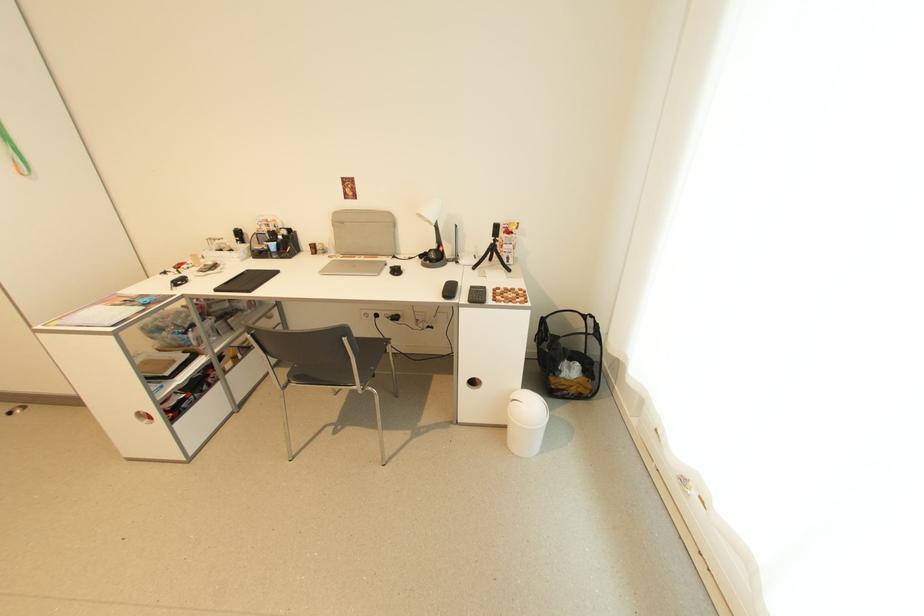
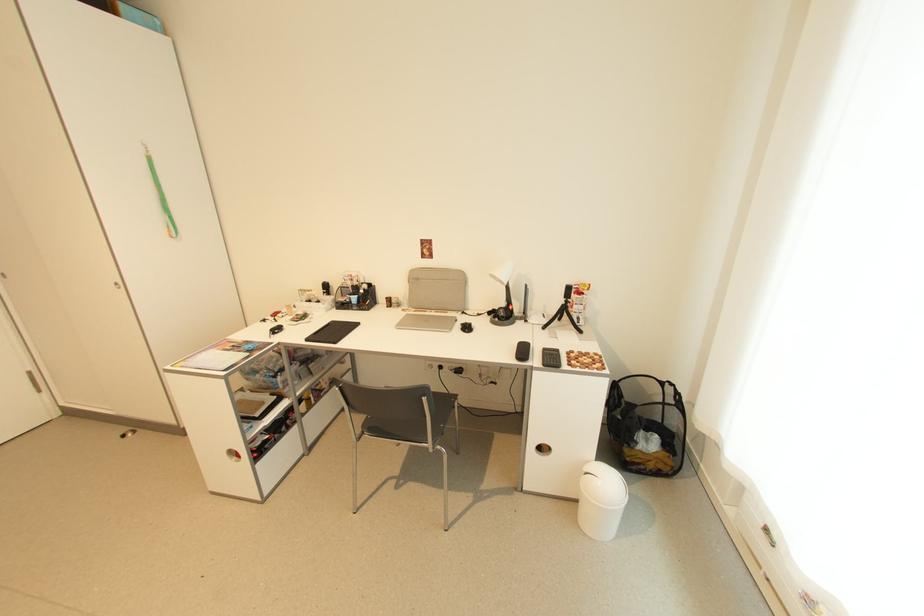
Locate, in the second image, the point that corresponds to the point at 347,224 in the first image.

(422, 281)